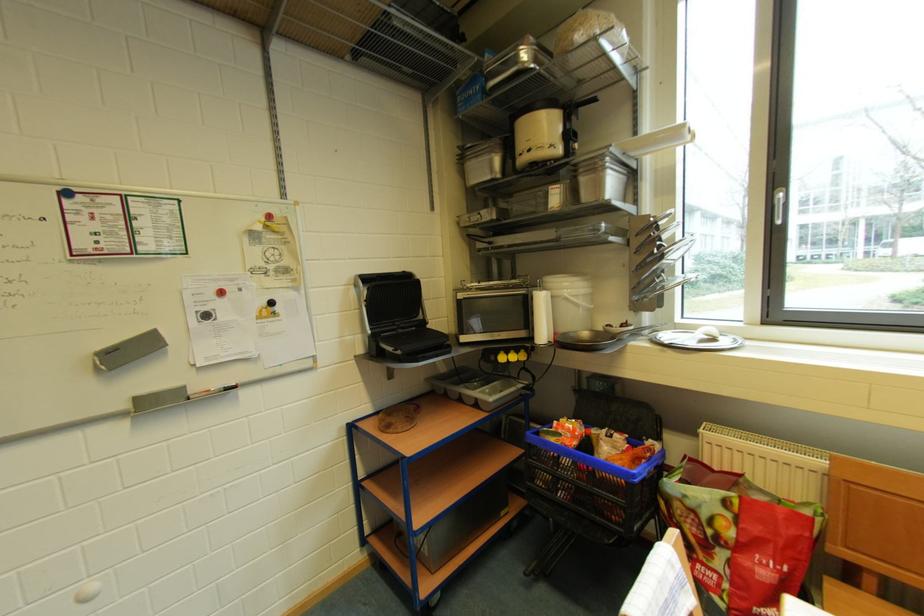
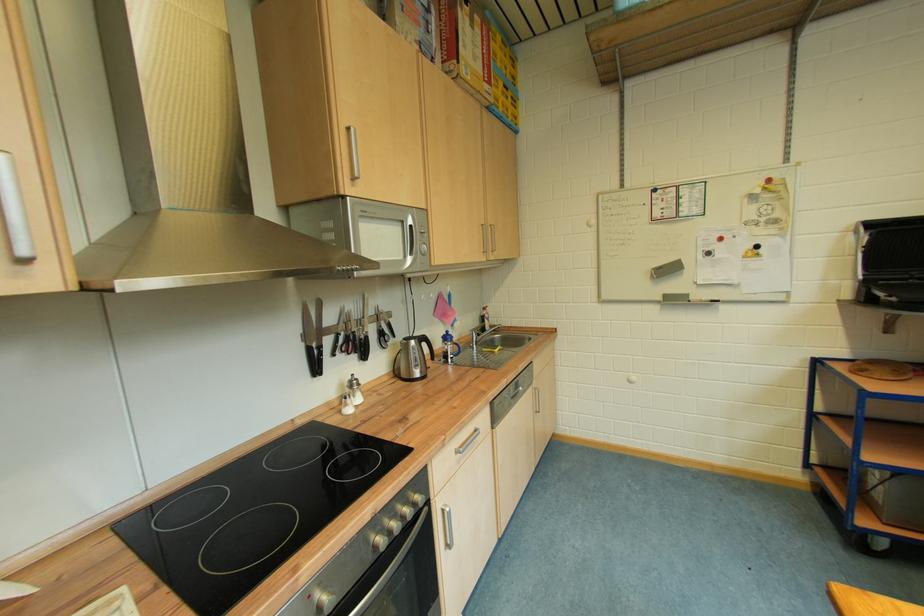
The point at (104,352) is marked in the first image. Where is the corresponding point in the second image?

(661, 270)